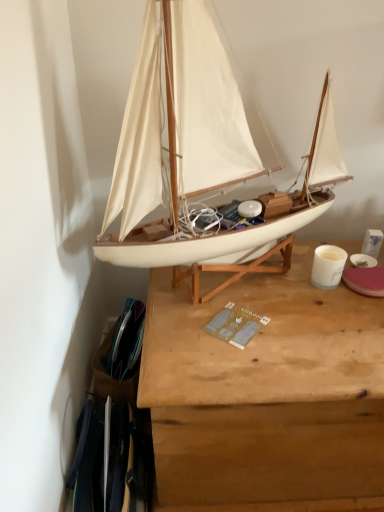
At what (x,y) coordinates should I click in order to perform the action: click on unoccupied area in front of white matte sailboat at center. Please return your answer as a coordinate pair (x, y). Image resolution: width=384 pixels, height=512 pixels. Looking at the image, I should click on (254, 352).